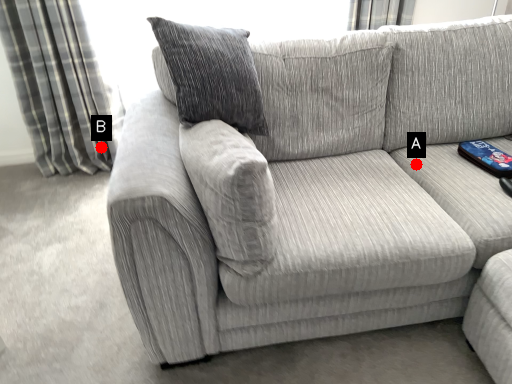
Question: Two points are circled on the image, labeled by A and B beside each circle. Which point is farther from the camera taking this photo?

Choices:
 (A) A is further
 (B) B is further

Answer: (B)